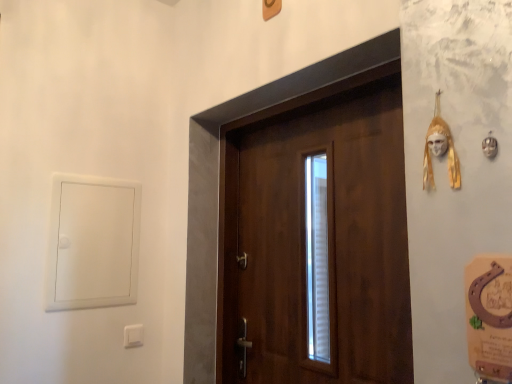
Question: Does white plastic window at left come in front of gold textured mask at upper right?

Choices:
 (A) yes
 (B) no

Answer: (B)

Question: Can you see white plastic window at left touching gold textured mask at upper right?

Choices:
 (A) no
 (B) yes

Answer: (A)

Question: Considering the relative sizes of white plastic window at left and gold textured mask at upper right in the image provided, is white plastic window at left shorter than gold textured mask at upper right?

Choices:
 (A) no
 (B) yes

Answer: (A)

Question: From the image's perspective, would you say white plastic window at left is positioned over gold textured mask at upper right?

Choices:
 (A) yes
 (B) no

Answer: (B)

Question: Is white plastic window at left positioned with its back to gold textured mask at upper right?

Choices:
 (A) no
 (B) yes

Answer: (A)

Question: Choose the correct answer: Is white plastic window at left inside wooden door at center or outside it?

Choices:
 (A) outside
 (B) inside

Answer: (A)

Question: In terms of width, does white plastic window at left look wider or thinner when compared to wooden door at center?

Choices:
 (A) wide
 (B) thin

Answer: (B)

Question: From a real-world perspective, is white plastic window at left above or below wooden door at center?

Choices:
 (A) below
 (B) above

Answer: (B)

Question: Considering the positions of point pos(125,296) and point pos(358,147), is point pos(125,296) closer or farther from the camera than point pos(358,147)?

Choices:
 (A) farther
 (B) closer

Answer: (A)

Question: Considering the positions of white plastic window at left and white plastic light switch at lower left in the image, is white plastic window at left taller or shorter than white plastic light switch at lower left?

Choices:
 (A) tall
 (B) short

Answer: (A)

Question: Is white plastic window at left in front of or behind white plastic light switch at lower left in the image?

Choices:
 (A) behind
 (B) front

Answer: (B)

Question: Which is correct: white plastic window at left is inside white plastic light switch at lower left, or outside of it?

Choices:
 (A) outside
 (B) inside

Answer: (A)

Question: In terms of size, does white plastic window at left appear bigger or smaller than white plastic light switch at lower left?

Choices:
 (A) small
 (B) big

Answer: (B)

Question: From a real-world perspective, relative to gold textured mask at upper right, is white plastic window at left vertically above or below?

Choices:
 (A) below
 (B) above

Answer: (A)

Question: Visually, is white plastic window at left positioned to the left or to the right of gold textured mask at upper right?

Choices:
 (A) right
 (B) left

Answer: (B)